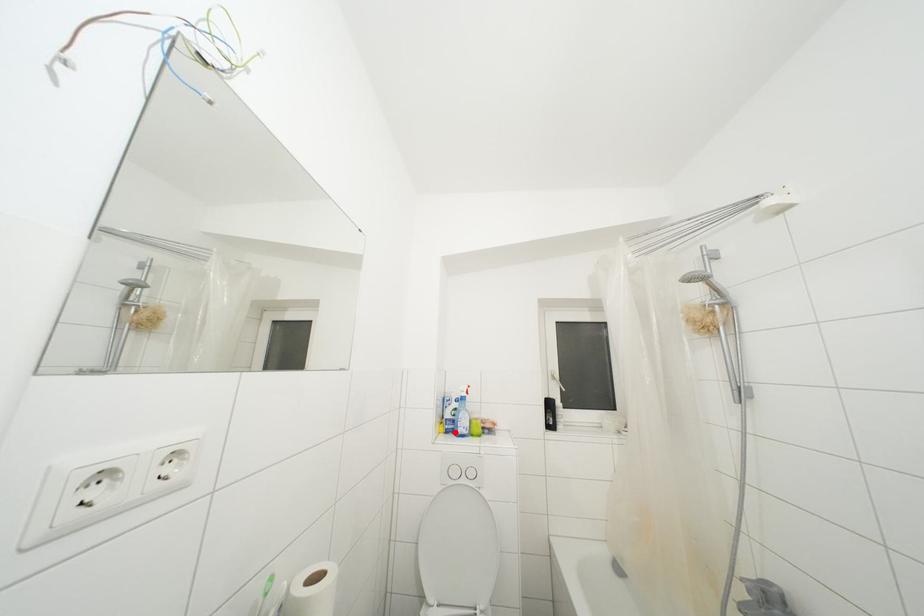
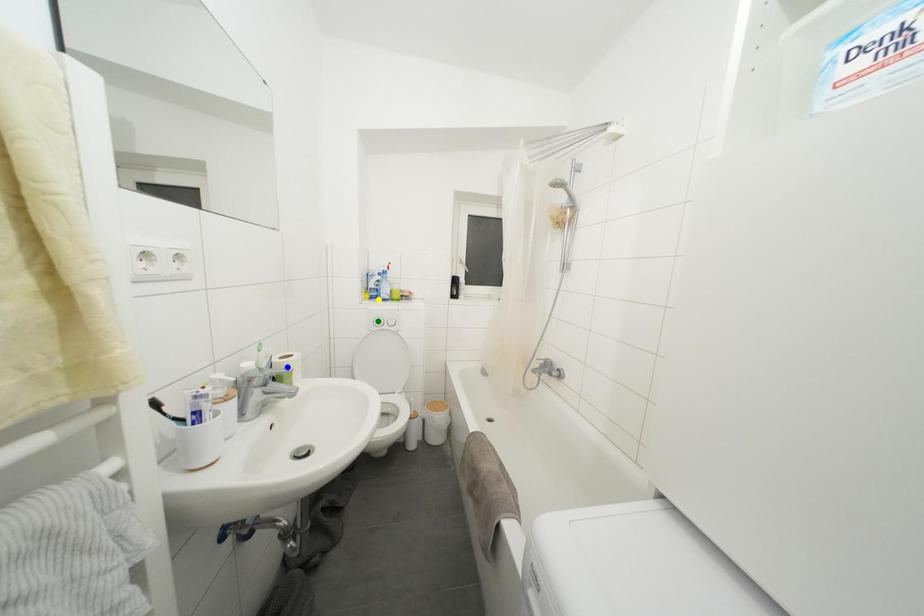
Question: I am providing you with two images of the same scene from different viewpoints. A red point is marked on the first image. You are given multiple points on the second image. In image 2, which mark is for the same physical point as the one in image 1?

Choices:
 (A) blue point
 (B) yellow point
 (C) green point

Answer: (B)